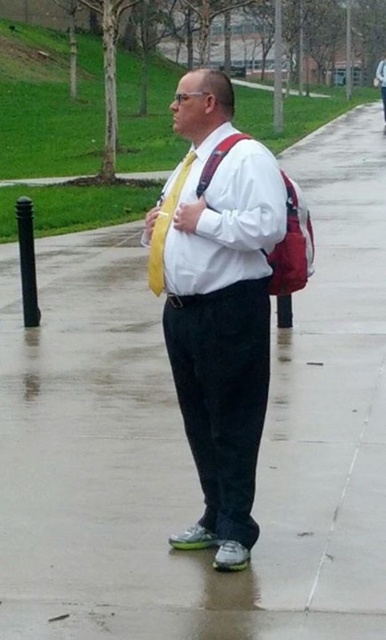
Who is more distant from viewer, (177, 349) or (147, 276)?

The point (147, 276) is behind.

Find the location of `matte yellow tie at center`. matte yellow tie at center is located at coordinates (221, 312).

Who is positioned more to the left, white smooth shirt at center or white matte dress shirt at center?

Positioned to the left is white smooth shirt at center.

Is white smooth shirt at center smaller than white matte dress shirt at center?

Yes.

At what (x,y) coordinates should I click in order to perform the action: click on white smooth shirt at center. Please return your answer as a coordinate pair (x, y). The width and height of the screenshot is (386, 640). Looking at the image, I should click on (230, 225).

Which of these two, white smooth shirt at center or yellow satin tie at center, stands shorter?

Standing shorter between the two is yellow satin tie at center.

Who is taller, white smooth shirt at center or yellow satin tie at center?

Standing taller between the two is white smooth shirt at center.

Who is more distant from viewer, (189, 196) or (164, 285)?

Point (164, 285)

The height and width of the screenshot is (640, 386). I want to click on white smooth shirt at center, so click(x=230, y=225).